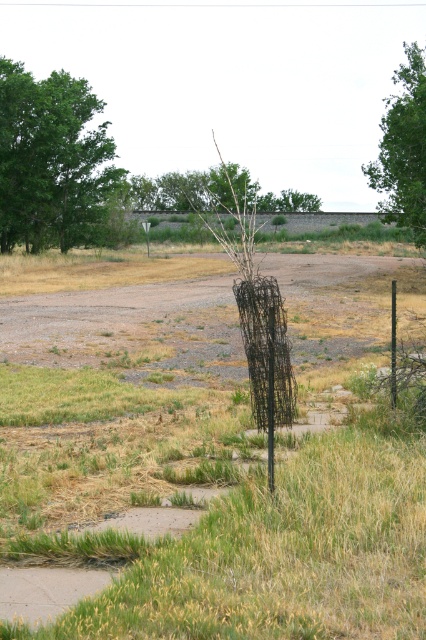
Question: Is green leafy tree at upper left smaller than green leafy tree at upper right?

Choices:
 (A) yes
 (B) no

Answer: (A)

Question: Among these objects, which one is nearest to the camera?

Choices:
 (A) green leafy tree at upper right
 (B) green leafy tree at upper left

Answer: (A)

Question: Among these objects, which one is farthest from the camera?

Choices:
 (A) green leafy tree at upper left
 (B) green leafy tree at upper right

Answer: (A)

Question: In this image, where is green leafy tree at upper left located relative to green leafy tree at upper right?

Choices:
 (A) right
 (B) left

Answer: (B)

Question: Does green leafy tree at upper left appear on the right side of green leafy tree at upper right?

Choices:
 (A) no
 (B) yes

Answer: (A)